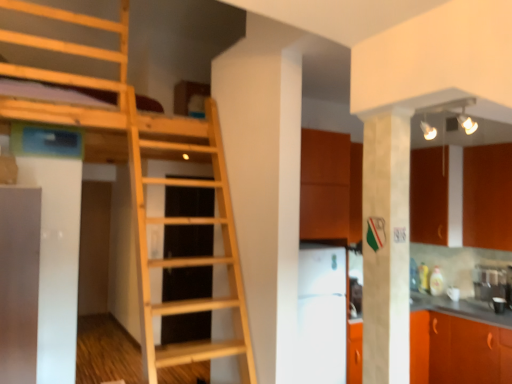
Question: From the image's perspective, is white marble pillar at center over light wood ladder at center?

Choices:
 (A) yes
 (B) no

Answer: (A)

Question: Is white marble pillar at center wider than light wood ladder at center?

Choices:
 (A) no
 (B) yes

Answer: (A)

Question: Is white marble pillar at center at the right side of light wood ladder at center?

Choices:
 (A) yes
 (B) no

Answer: (A)

Question: Could light wood ladder at center be considered to be inside white marble pillar at center?

Choices:
 (A) yes
 (B) no

Answer: (B)

Question: From a real-world perspective, is white marble pillar at center on top of light wood ladder at center?

Choices:
 (A) yes
 (B) no

Answer: (A)

Question: Considering the relative sizes of white marble pillar at center and light wood ladder at center in the image provided, is white marble pillar at center shorter than light wood ladder at center?

Choices:
 (A) yes
 (B) no

Answer: (A)

Question: Considering the relative sizes of light wood ladder at center and white glossy refrigerator at center in the image provided, is light wood ladder at center wider than white glossy refrigerator at center?

Choices:
 (A) yes
 (B) no

Answer: (A)

Question: Is light wood ladder at center looking in the opposite direction of white glossy refrigerator at center?

Choices:
 (A) no
 (B) yes

Answer: (A)

Question: Can you confirm if light wood ladder at center is taller than white glossy refrigerator at center?

Choices:
 (A) yes
 (B) no

Answer: (A)

Question: From the image's perspective, does light wood ladder at center appear lower than white glossy refrigerator at center?

Choices:
 (A) yes
 (B) no

Answer: (B)

Question: Considering the relative sizes of light wood ladder at center and white glossy refrigerator at center in the image provided, is light wood ladder at center bigger than white glossy refrigerator at center?

Choices:
 (A) yes
 (B) no

Answer: (A)

Question: Does light wood ladder at center have a lesser width compared to white glossy refrigerator at center?

Choices:
 (A) yes
 (B) no

Answer: (B)

Question: Is light wood ladder at center looking in the opposite direction of orange matte cabinet at lower right, the first cabinetry in the bottom-to-top sequence?

Choices:
 (A) no
 (B) yes

Answer: (A)